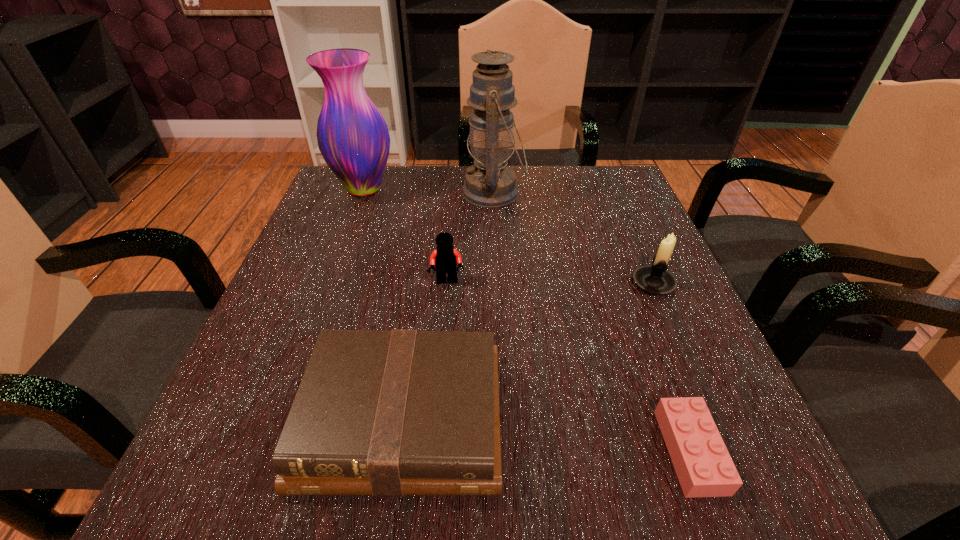
Identify the location of oil lamp. (491, 183).

Where is `vase`? The height and width of the screenshot is (540, 960). vase is located at coordinates (353, 138).

Where is `the fourth shortest object`? The width and height of the screenshot is (960, 540). the fourth shortest object is located at coordinates (656, 279).

Locate an element on the screen. Image resolution: width=960 pixels, height=540 pixels. the farther Lego is located at coordinates (445, 258).

Where is `the taller Lego`? the taller Lego is located at coordinates (445, 258).

This screenshot has height=540, width=960. I want to click on the fifth tallest object, so click(388, 413).

This screenshot has height=540, width=960. Find the location of `the shortest object`. the shortest object is located at coordinates (703, 465).

The height and width of the screenshot is (540, 960). I want to click on the nearer Lego, so click(703, 465).

The height and width of the screenshot is (540, 960). I want to click on vacant space located 0.200m on the front of the oil lamp, so click(x=497, y=275).

Locate an element on the screen. This screenshot has width=960, height=540. vacant space located on the right of the vase is located at coordinates (550, 188).